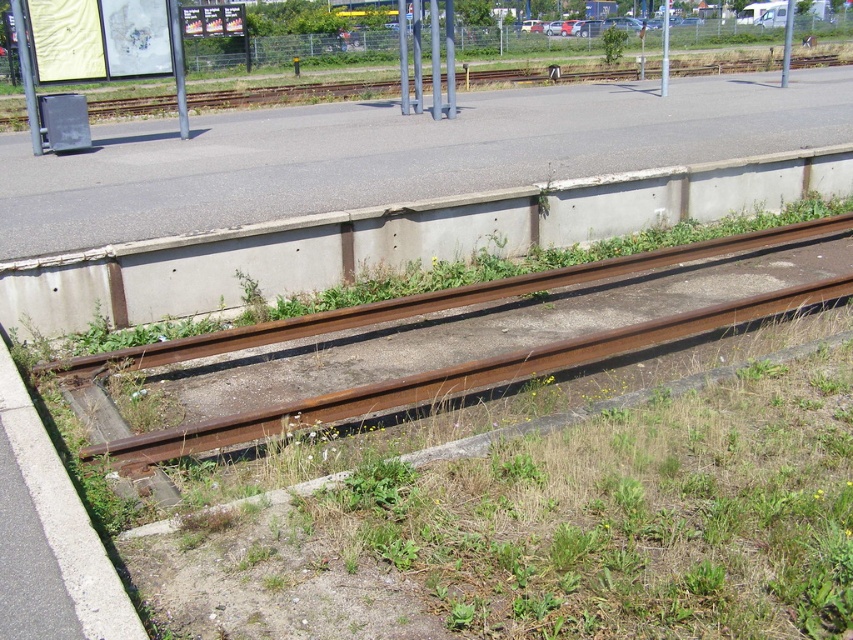
In the scene shown: Can you confirm if rusty metal train track at lower center is positioned to the right of metallic gray trash can at left?

Indeed, rusty metal train track at lower center is positioned on the right side of metallic gray trash can at left.

Can you confirm if rusty metal train track at lower center is thinner than metallic gray trash can at left?

Yes.

Between point (590, 360) and point (56, 76), which one is positioned in front?

Point (590, 360)

Identify the location of rusty metal train track at lower center. The image size is (853, 640). (451, 378).

Is concrete at center wider than rusty metal train track at lower center?

Indeed, concrete at center has a greater width compared to rusty metal train track at lower center.

Can you confirm if concrete at center is positioned to the left of rusty metal train track at lower center?

Incorrect, concrete at center is not on the left side of rusty metal train track at lower center.

Is point (799, 172) positioned before point (759, 244)?

No.

You are a GUI agent. You are given a task and a screenshot of the screen. Output one action in this format:
    pyautogui.click(x=<x>, y=<y>)
    Task: Click on the concrete at center
    The image size is (853, 640).
    Given the screenshot: What is the action you would take?
    pyautogui.click(x=393, y=237)

Does rusty metal train track at lower center come behind green leafy plant at center?

No.

This screenshot has width=853, height=640. What do you see at coordinates (451, 378) in the screenshot?
I see `rusty metal train track at lower center` at bounding box center [451, 378].

This screenshot has height=640, width=853. What do you see at coordinates (451, 378) in the screenshot?
I see `rusty metal train track at lower center` at bounding box center [451, 378].

Identify the location of rusty metal train track at lower center. This screenshot has width=853, height=640. (451, 378).